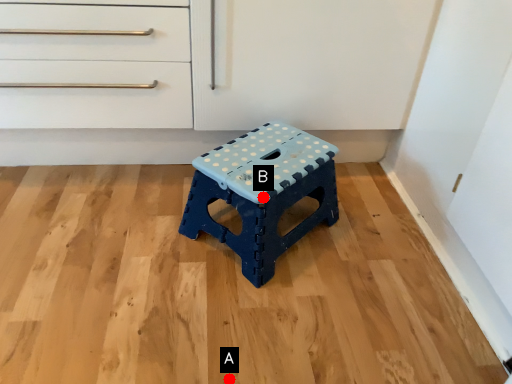
Question: Two points are circled on the image, labeled by A and B beside each circle. Which point appears farthest from the camera in this image?

Choices:
 (A) A is further
 (B) B is further

Answer: (B)